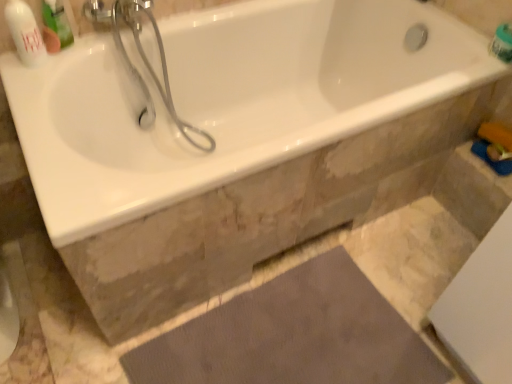
Question: Considering the relative sizes of white glossy shower head at upper left and white glossy bathtub at upper center in the image provided, is white glossy shower head at upper left smaller than white glossy bathtub at upper center?

Choices:
 (A) no
 (B) yes

Answer: (B)

Question: Is white glossy shower head at upper left positioned beyond the bounds of white glossy bathtub at upper center?

Choices:
 (A) no
 (B) yes

Answer: (A)

Question: Can you confirm if white glossy shower head at upper left is shorter than white glossy bathtub at upper center?

Choices:
 (A) no
 (B) yes

Answer: (A)

Question: Is white glossy shower head at upper left with white glossy bathtub at upper center?

Choices:
 (A) no
 (B) yes

Answer: (A)

Question: From a real-world perspective, is white glossy shower head at upper left positioned over white glossy bathtub at upper center based on gravity?

Choices:
 (A) yes
 (B) no

Answer: (A)

Question: Is white glossy shower head at upper left further to camera compared to white glossy bathtub at upper center?

Choices:
 (A) yes
 (B) no

Answer: (A)

Question: Does white glossy bathtub at upper center lie behind green plastic mouthwash at upper left?

Choices:
 (A) no
 (B) yes

Answer: (A)

Question: Is green plastic mouthwash at upper left a part of white glossy bathtub at upper center?

Choices:
 (A) yes
 (B) no

Answer: (B)

Question: Does white glossy bathtub at upper center lie in front of green plastic mouthwash at upper left?

Choices:
 (A) no
 (B) yes

Answer: (B)

Question: Is white glossy bathtub at upper center shorter than green plastic mouthwash at upper left?

Choices:
 (A) yes
 (B) no

Answer: (B)

Question: From the image's perspective, is white glossy bathtub at upper center on green plastic mouthwash at upper left?

Choices:
 (A) no
 (B) yes

Answer: (A)

Question: From a real-world perspective, is white glossy bathtub at upper center located beneath green plastic mouthwash at upper left?

Choices:
 (A) yes
 (B) no

Answer: (A)

Question: Is green plastic container at upper right, which is the first toiletry from back to front, not within white glossy bottle at upper left, placed as the 2th toiletry when sorted from back to front?

Choices:
 (A) yes
 (B) no

Answer: (A)